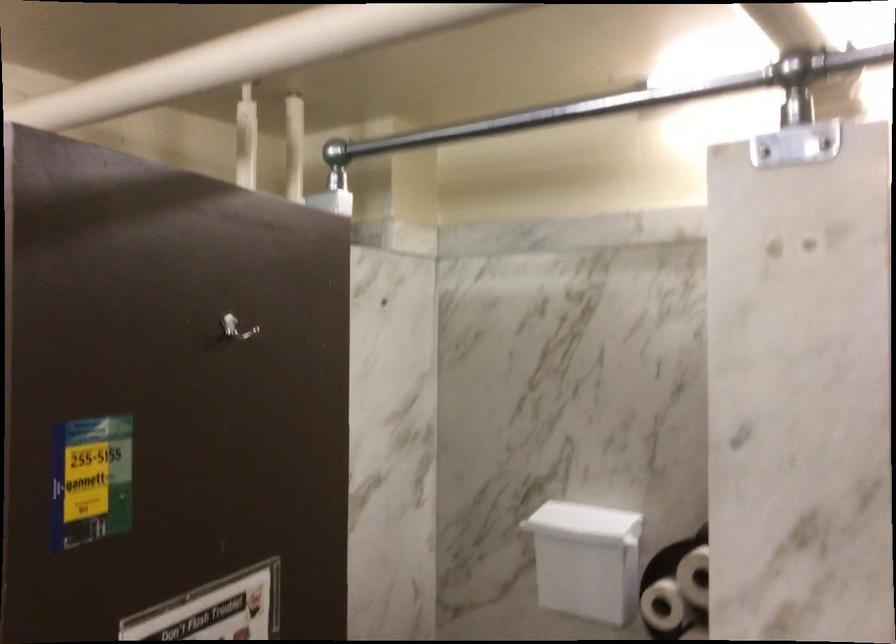
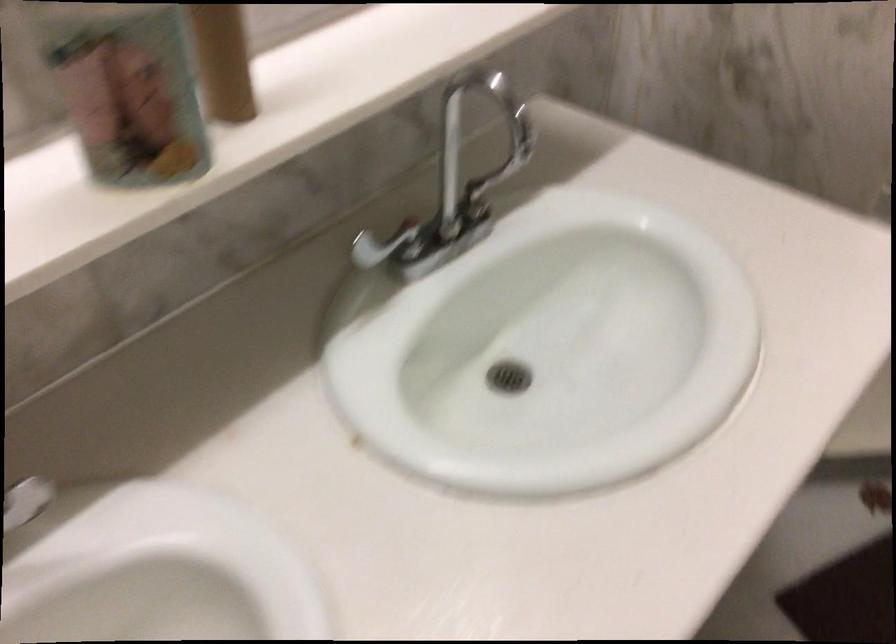
The images are taken continuously from a first-person perspective. In which direction is your viewpoint rotating?

The rotation direction of the camera is left-down.